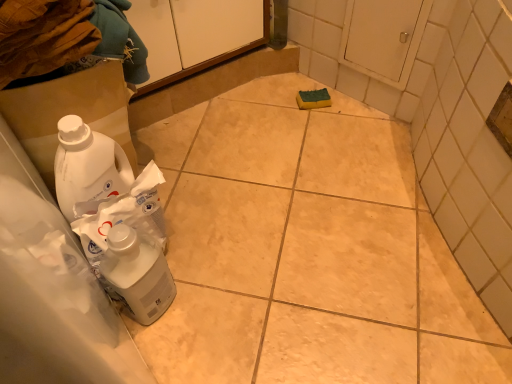
Question: Can you confirm if white cardboard box at lower left is smaller than white matte cabinet at upper center?

Choices:
 (A) no
 (B) yes

Answer: (B)

Question: Considering the relative sizes of white cardboard box at lower left and white matte cabinet at upper center in the image provided, is white cardboard box at lower left bigger than white matte cabinet at upper center?

Choices:
 (A) yes
 (B) no

Answer: (B)

Question: Is white cardboard box at lower left not inside white matte cabinet at upper center?

Choices:
 (A) yes
 (B) no

Answer: (A)

Question: Is white cardboard box at lower left at the right side of white matte cabinet at upper center?

Choices:
 (A) no
 (B) yes

Answer: (A)

Question: Is white cardboard box at lower left wider than white matte cabinet at upper center?

Choices:
 (A) yes
 (B) no

Answer: (B)

Question: Is white cardboard box at lower left at the left side of white matte cabinet at upper center?

Choices:
 (A) no
 (B) yes

Answer: (B)

Question: Is white matte cabinet at upper center next to white cardboard box at lower left?

Choices:
 (A) yes
 (B) no

Answer: (B)

Question: Can you confirm if white matte cabinet at upper center is taller than white cardboard box at lower left?

Choices:
 (A) no
 (B) yes

Answer: (A)

Question: Is white matte cabinet at upper center behind white cardboard box at lower left?

Choices:
 (A) no
 (B) yes

Answer: (B)

Question: Is there a large distance between white matte cabinet at upper center and white cardboard box at lower left?

Choices:
 (A) yes
 (B) no

Answer: (B)

Question: Considering the relative sizes of white matte cabinet at upper center and white cardboard box at lower left in the image provided, is white matte cabinet at upper center bigger than white cardboard box at lower left?

Choices:
 (A) no
 (B) yes

Answer: (B)

Question: Can you confirm if white matte cabinet at upper center is wider than white cardboard box at lower left?

Choices:
 (A) yes
 (B) no

Answer: (A)

Question: Can you confirm if white glossy plastic bottle at lower left is shorter than white matte cabinet at upper center?

Choices:
 (A) no
 (B) yes

Answer: (A)